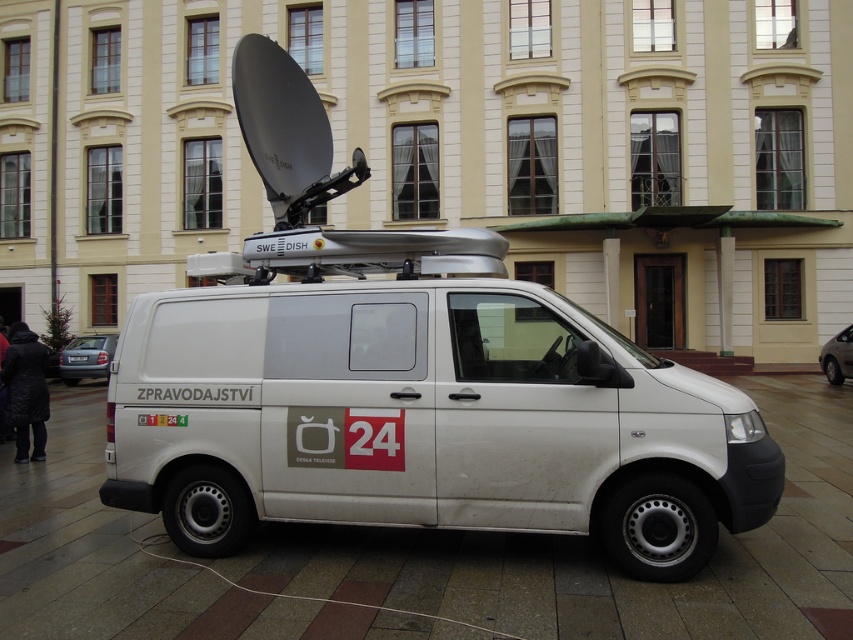
You are a delivery driver who needs to park a truck that is the same size as the white matte van at center. There is a parking spot next to the matte gray sedan at lower left. Will the truck fit in the parking spot if you park it there?

The white matte van at center is bigger than the matte gray sedan at lower left. Since the truck is the same size as the van, it is larger than the sedan. Therefore, the truck may not fit in the parking spot designed for a smaller vehicle like the sedan.

You are a delivery person who needs to park your truck, which is 2 meters tall, in this parking area. The parking spot is near the white matte van at center and the matte gray sedan at lower left. Based on the vehicles present, can your truck fit in terms of height?

The white matte van at center has a greater height compared to matte gray sedan at lower left. Since the van is taller than the sedan and your truck is 2 meters tall, you need to compare the truck height with the van. If the van is taller than 2 meters, your truck can fit as it is shorter than the van. However, if the van is shorter than 2 meters, your truck might not fit. Unfortunately, the exact height of the van isn not provided, so it is uncertain whether your truck can fit here.